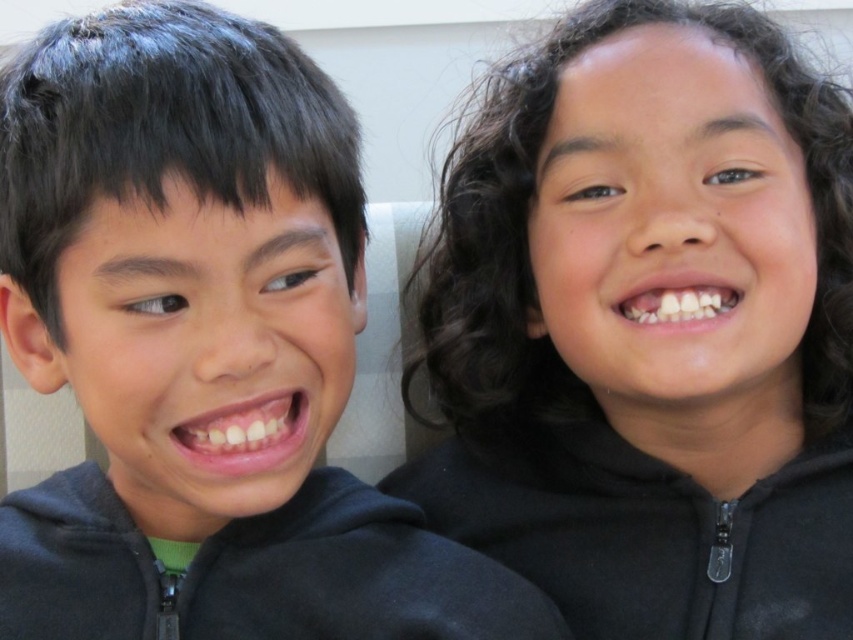
You are standing in front of the two children and want to place a sticker on the point that is closer to you. Which point should you choose between point (x=546, y=563) and point (x=234, y=600)?

You should choose point (x=234, y=600) because it is closer to you than point (x=546, y=563).

You are a clothing designer trying to create a matching set for these two children. Given that the black matte hoodie at left is larger than the black fleece sweatshirt at right, how can you adjust the sizes to ensure they look proportional when worn together?

To ensure proportionality, you can either reduce the size of the black matte hoodie at left or increase the size of the black fleece sweatshirt at right so that both garments have similar dimensions when worn.

You are trying to locate the black matte hoodie at left in the image. According to the coordinates provided, where exactly is it positioned?

The black matte hoodie at left is located at point 0.547 on the x axis and 0.239 on the y axis.